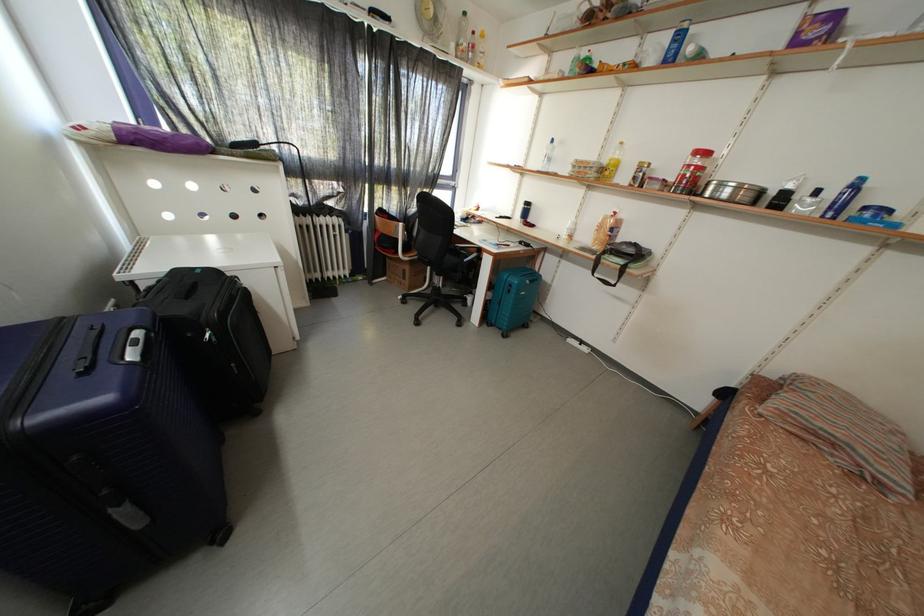
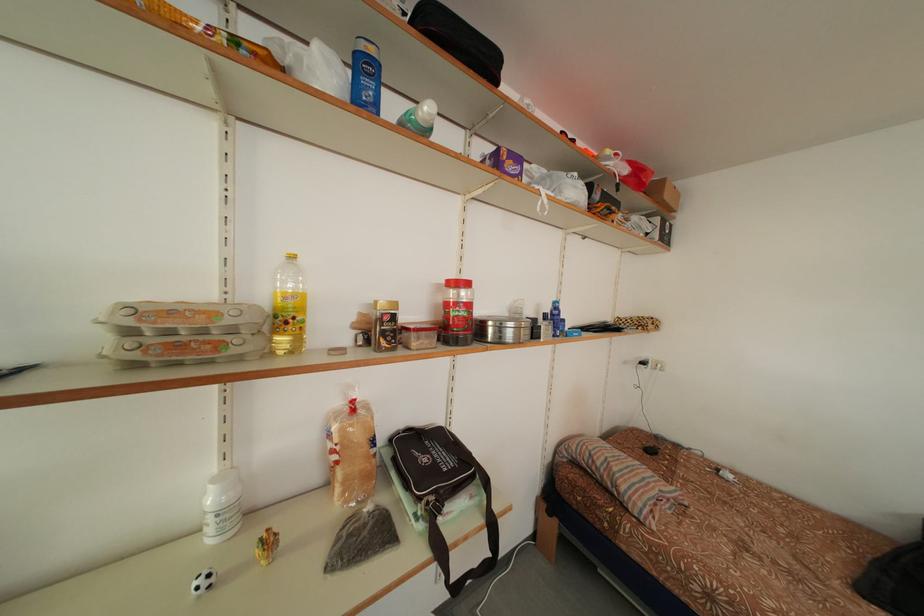
The point at (590,167) is marked in the first image. Where is the corresponding point in the second image?

(178, 317)